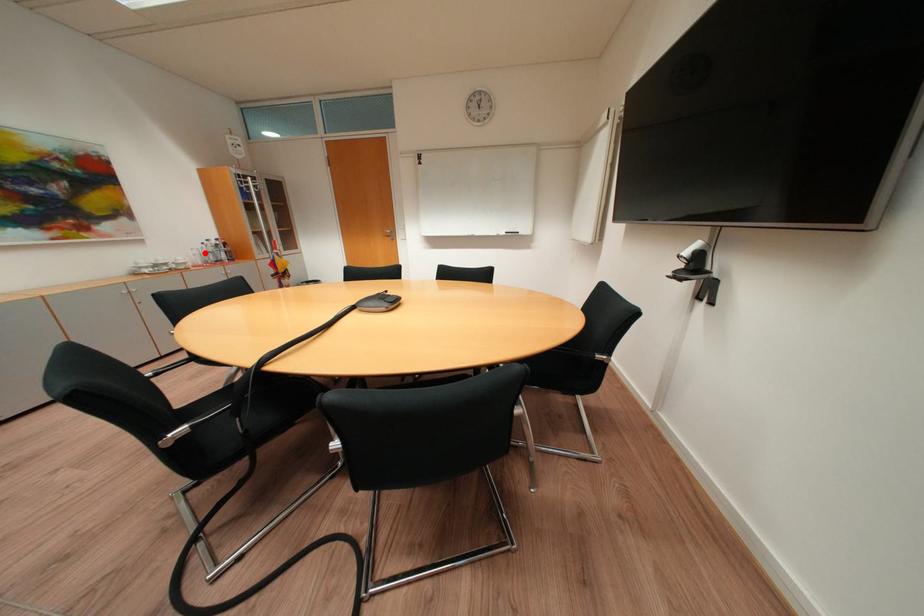
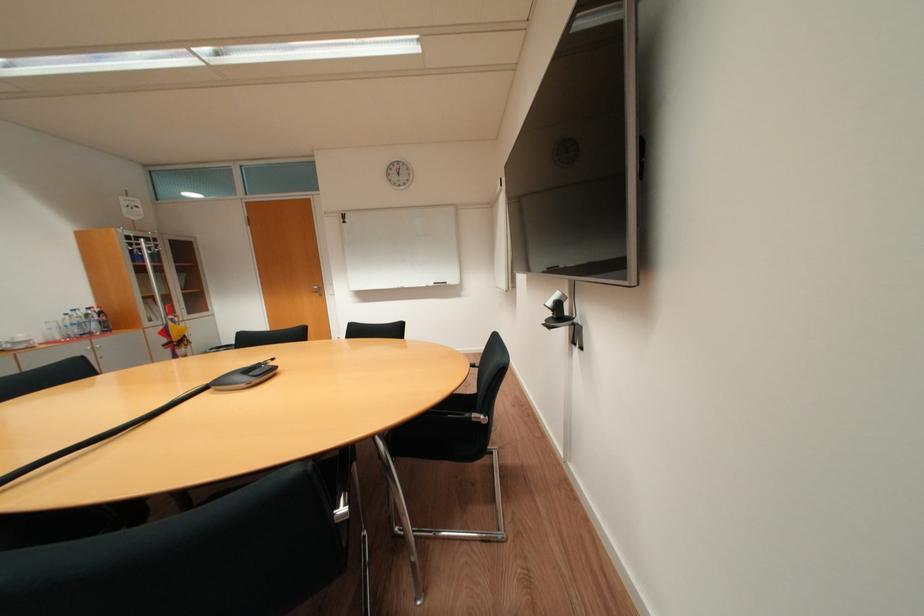
The point at the highlighted location is marked in the first image. Where is the corresponding point in the second image?

(62, 326)